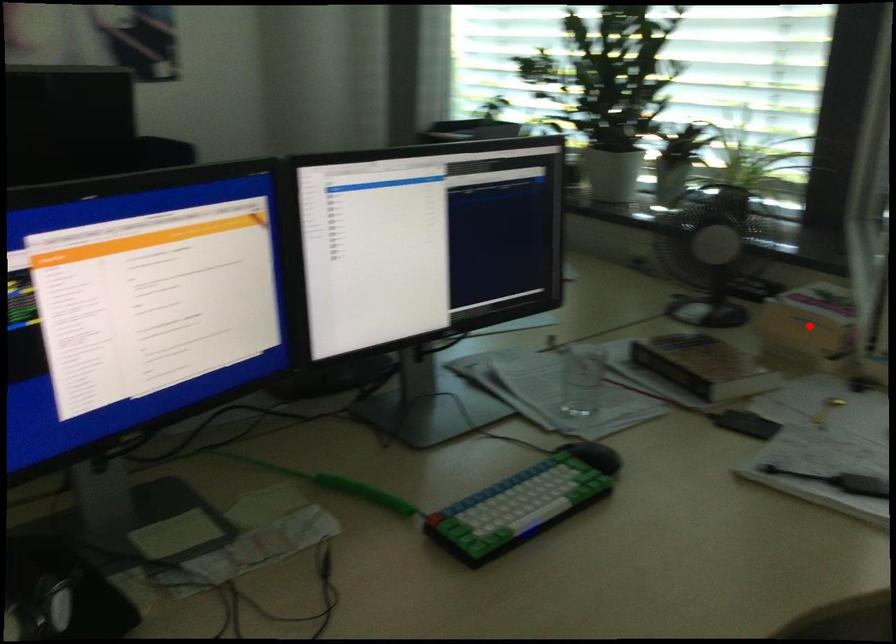
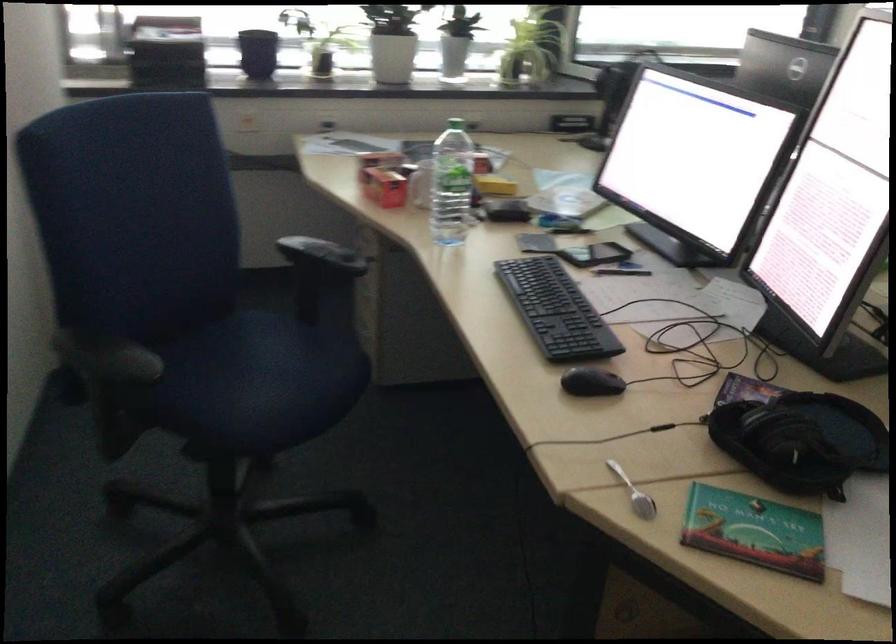
Question: I am providing you with two images of the same scene from different viewpoints. A red point is marked on the first image. At the location where the point appears in image 1, is it still visible in image 2?

Choices:
 (A) Yes
 (B) No

Answer: (B)